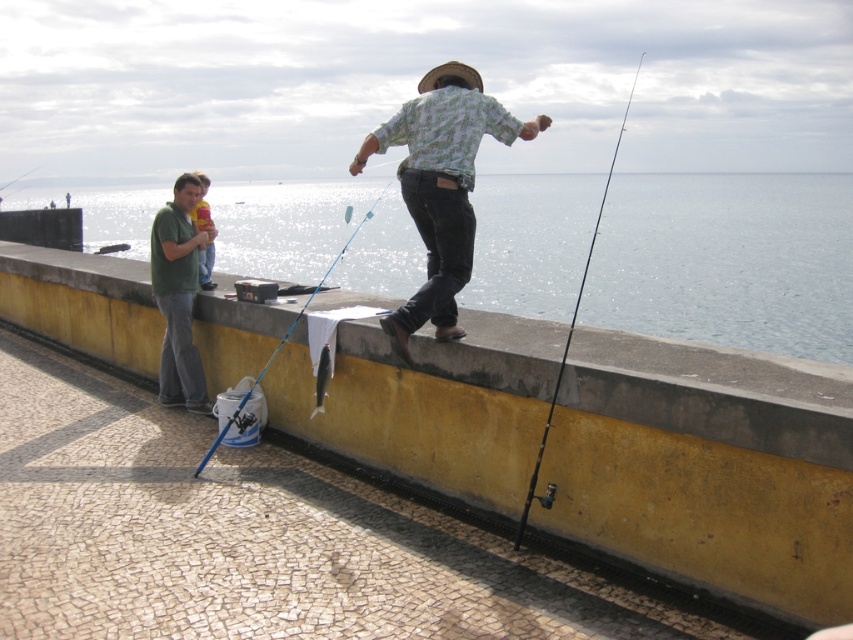
You are standing on the mosaic pavement looking towards the sea. You see the clear blue water at center and the green cotton shirt at left. Which object is closer to the sea?

The clear blue water at center is closer to the sea because it is located to the right of the green cotton shirt at left, which is further inland.

You are standing on the mosaic tiled pavement in the seaside scene. You want to throw a stone into the clear blue water at center. Can you reach the water without stepping off the pavement?

The clear blue water at center is located at point [728,260], which is within the area accessible from the mosaic tiled pavement, so yes, you can reach it without stepping off.

You are a photographer trying to capture a photo of the fishing scene. You need to ensure that the matte green shirt at left and the blue metallic fishing pole at left are both visible in the frame. Given their relative heights, which object will appear taller in the photo?

The matte green shirt at left will appear taller in the photo since it has a greater height compared to the blue metallic fishing pole at left.